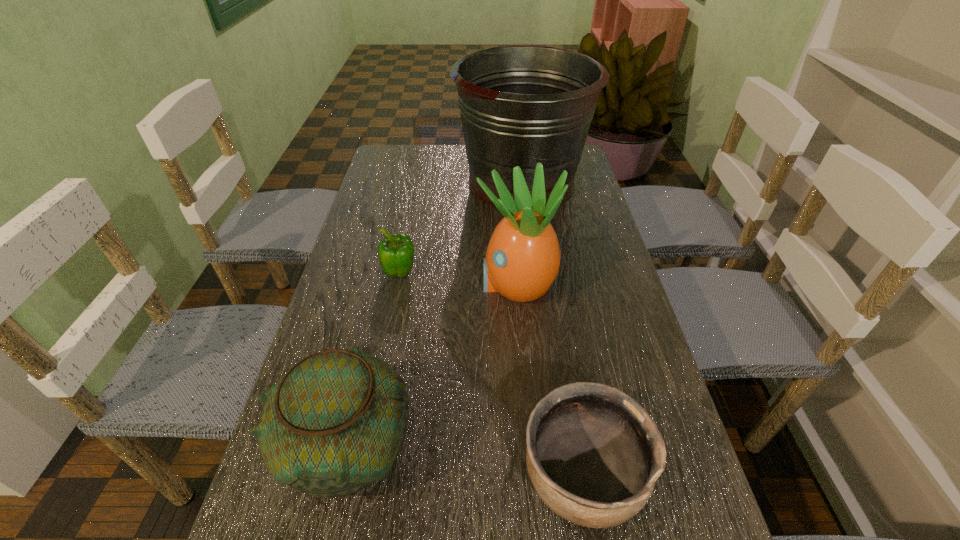
Identify the location of the farthest object. (520, 105).

This screenshot has width=960, height=540. Identify the location of the second tallest object. (522, 260).

I want to click on the third tallest object, so click(x=335, y=423).

Find the location of a particular element. The width and height of the screenshot is (960, 540). the left pottery is located at coordinates (335, 423).

This screenshot has width=960, height=540. What are the coordinates of `bell pepper` in the screenshot? It's located at (396, 252).

Locate an element on the screen. The image size is (960, 540). vacant space positioned on the left of the farthest object is located at coordinates (382, 182).

Where is `free space located 0.290m at the entrance of the fourth shortest object`? This screenshot has height=540, width=960. free space located 0.290m at the entrance of the fourth shortest object is located at coordinates (366, 284).

This screenshot has width=960, height=540. What are the coordinates of `vacant region located 0.300m at the entrance of the fourth shortest object` in the screenshot? It's located at (362, 284).

Where is `free space located at the entrance of the fourth shortest object`? The height and width of the screenshot is (540, 960). free space located at the entrance of the fourth shortest object is located at coordinates (354, 284).

Where is `free region located on the back of the left pottery`? The image size is (960, 540). free region located on the back of the left pottery is located at coordinates (373, 335).